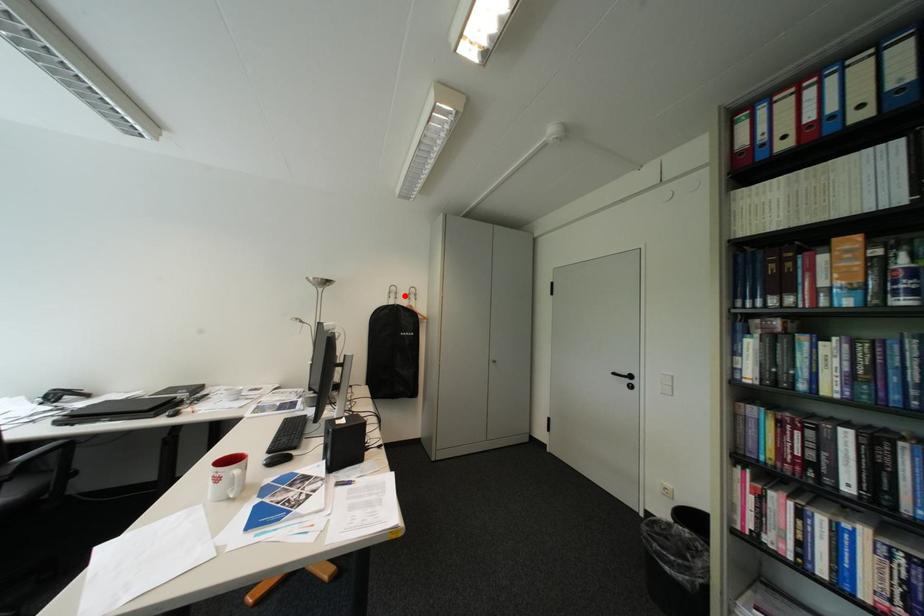
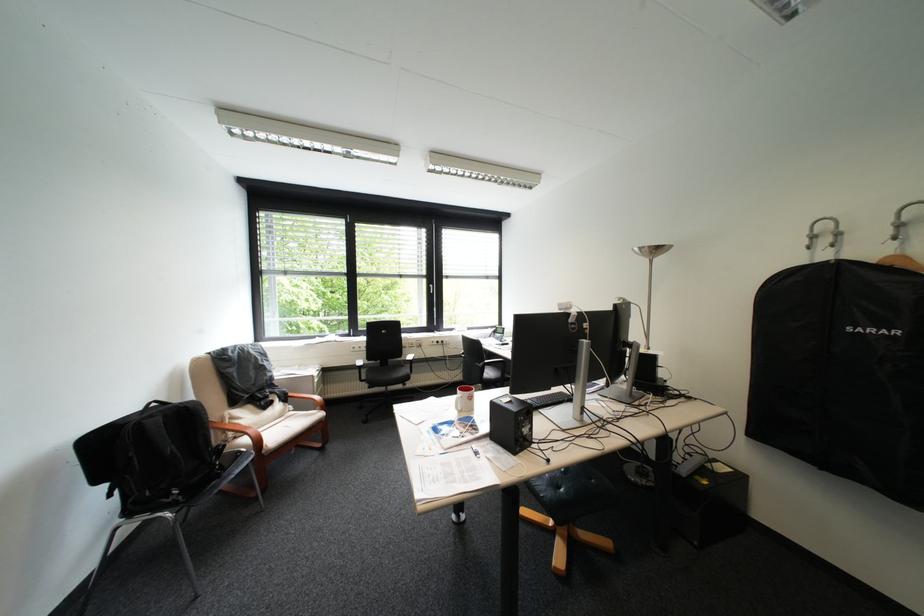
Locate, in the second image, the point that corresponds to the highlighted location in the first image.

(837, 241)